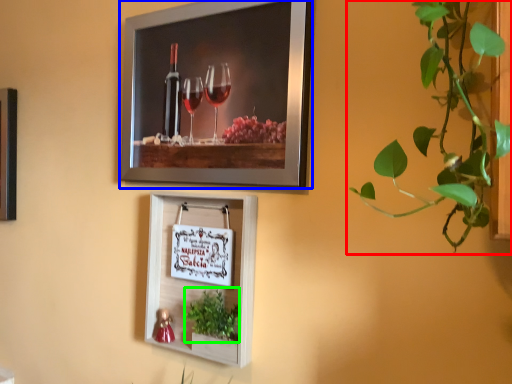
Question: Which object is positioned farthest from houseplant (highlighted by a red box)? Select from picture frame (highlighted by a blue box) and plant (highlighted by a green box).

Choices:
 (A) picture frame
 (B) plant

Answer: (B)